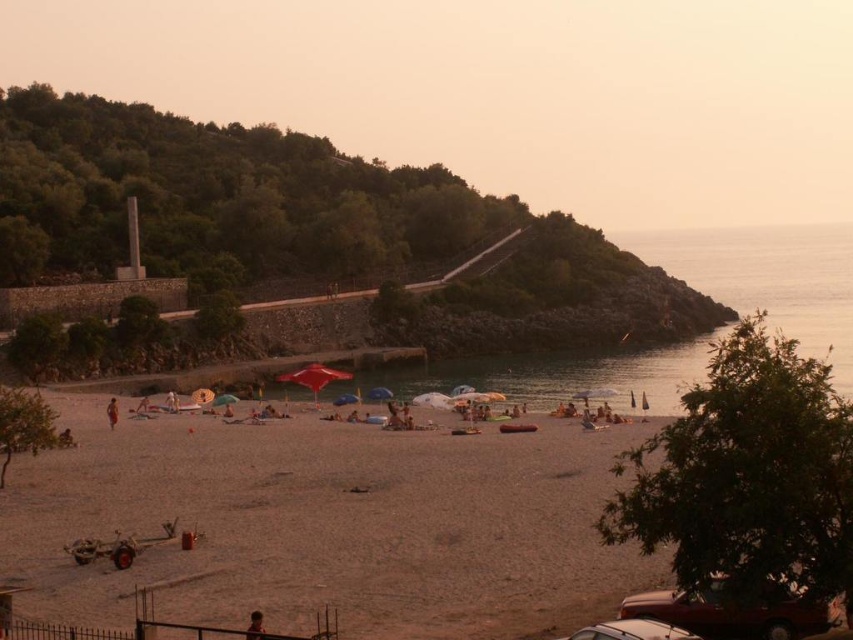
Question: Can you confirm if light brown sand at center is positioned above matte red umbrella at center?

Choices:
 (A) no
 (B) yes

Answer: (A)

Question: Which is nearer to the light brown sand at center?

Choices:
 (A) brown fabric person at lower left
 (B) metallic silver car at lower center
 (C) shiny red car at lower right

Answer: (C)

Question: Can you confirm if green leafy hillside at upper left is positioned above smooth skin person at lower center?

Choices:
 (A) no
 (B) yes

Answer: (B)

Question: Can you confirm if metallic silver car at lower center is thinner than blue fabric umbrella at center?

Choices:
 (A) yes
 (B) no

Answer: (A)

Question: Based on their relative distances, which object is nearer to the matte red umbrella at center?

Choices:
 (A) clear water at right
 (B) metallic silver car at lower center
 (C) smooth skin person at lower center

Answer: (B)

Question: Which object is farther from the camera taking this photo?

Choices:
 (A) clear water at right
 (B) brown fabric person at lower left
 (C) shiny red car at lower right
 (D) matte red umbrella at center

Answer: (D)